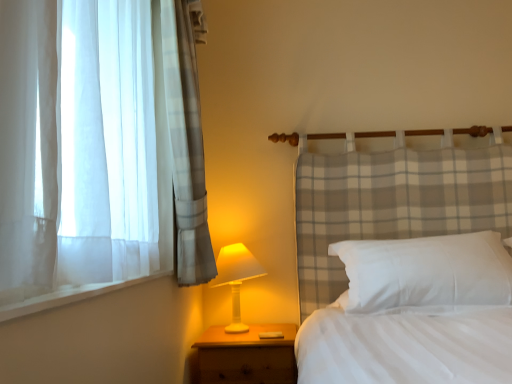
Question: Is point (367, 279) closer or farther from the camera than point (258, 264)?

Choices:
 (A) closer
 (B) farther

Answer: (A)

Question: From a real-world perspective, is white soft pillow at center positioned above or below white plastic table lamp at lower center?

Choices:
 (A) above
 (B) below

Answer: (A)

Question: Estimate the real-world distances between objects in this image. Which object is farther from the wooden nightstand at lower left?

Choices:
 (A) white soft pillow at center
 (B) white plastic table lamp at lower center

Answer: (A)

Question: Based on their relative distances, which object is farther from the white soft pillow at center?

Choices:
 (A) wooden nightstand at lower left
 (B) white plastic table lamp at lower center

Answer: (B)